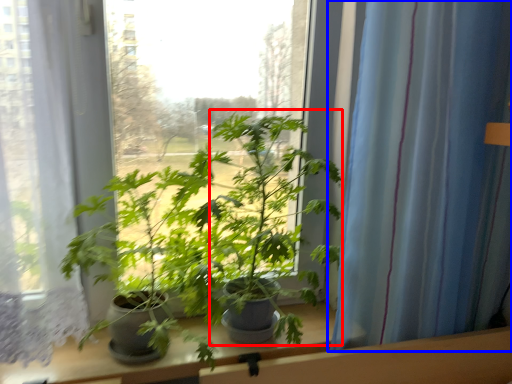
Question: Which of the following is the closest to the observer, parsley (highlighted by a red box) or curtain (highlighted by a blue box)?

Choices:
 (A) parsley
 (B) curtain

Answer: (A)